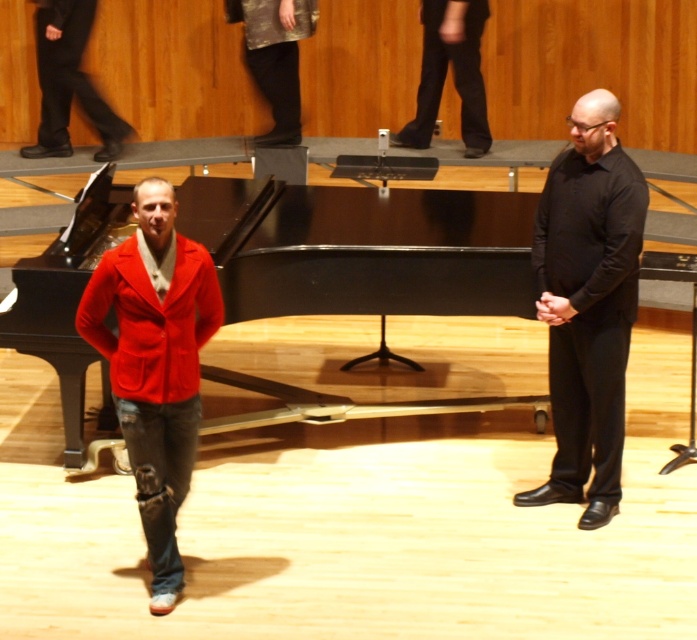
You are a photographer setting up for a photoshoot on the stage. You need to position a light to the left of both the matte red blazer at left and the denim jacket at left. Is this possible given their current positions?

The matte red blazer at left is to the right of denim jacket at left, so placing a light to the left of both would be possible by positioning it to the left of the denim jacket at left, which is the furthest left object.

You are a photographer setting up for a concert. You need to place a microphone stand between the black smooth shirt at right and the black smooth pants at upper center. Which side of the stand should face the thinner object?

The black smooth shirt at right is thinner than the black smooth pants at upper center, so the microphone stand should be positioned with its narrower side facing the black smooth shirt at right.

You are an event planner trying to arrange a photo shoot in the concert hall. You need to position a large camera setup between the denim jacket at left and the black smooth pants at upper center. Based on their sizes, will there be enough space between them to place the camera setup?

The denim jacket at left occupies less space than black smooth pants at upper center. Since the denim jacket is smaller, there should be sufficient space between them to place the camera setup.